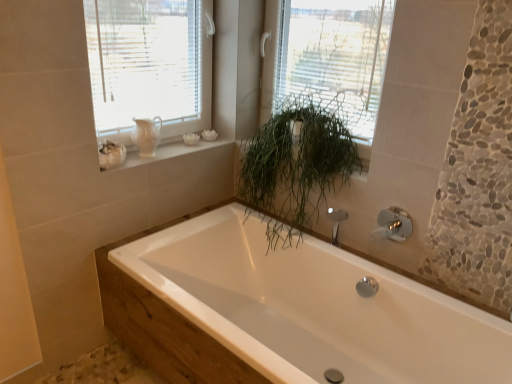
Identify the location of green leafy plant at upper center. Image resolution: width=512 pixels, height=384 pixels. (327, 60).

This screenshot has height=384, width=512. Describe the element at coordinates (393, 225) in the screenshot. I see `chrome metallic faucet at upper right` at that location.

Measure the distance between point (222,267) and camera.

A distance of 7.18 feet exists between point (222,267) and camera.

Describe the element at coordinates (162, 152) in the screenshot. I see `white ceramic vase at upper left` at that location.

Measure the distance between point (152, 133) and camera.

7.08 feet.

Measure the distance between matte white pitcher at upper left and camera.

The distance of matte white pitcher at upper left from camera is 6.77 feet.

I want to click on green leafy plant at upper center, so click(327, 60).

Between matte white pitcher at upper left and green leafy plant at center, which one has less height?

matte white pitcher at upper left.

Consider the image. Is matte white pitcher at upper left closer to the viewer compared to green leafy plant at center?

That is False.

Considering the positions of objects matte white pitcher at upper left and green leafy plant at center in the image provided, who is more to the left, matte white pitcher at upper left or green leafy plant at center?

matte white pitcher at upper left.

Is green leafy plant at center located within matte white pitcher at upper left?

Definitely not — green leafy plant at center is not inside matte white pitcher at upper left.

Which object is positioned more to the left, matte white pitcher at upper left or white glossy bathtub at center?

From the viewer's perspective, matte white pitcher at upper left appears more on the left side.

Is matte white pitcher at upper left wider than white glossy bathtub at center?

No.

From the image's perspective, which object appears higher, matte white pitcher at upper left or white glossy bathtub at center?

matte white pitcher at upper left, from the image's perspective.

Relative to white glossy bathtub at center, is matte white pitcher at upper left in front or behind?

Visually, matte white pitcher at upper left is located behind white glossy bathtub at center.

Can you see green leafy plant at upper center touching matte white pitcher at upper left?

No, green leafy plant at upper center is not in contact with matte white pitcher at upper left.

Is green leafy plant at upper center completely or partially outside of matte white pitcher at upper left?

green leafy plant at upper center lies outside matte white pitcher at upper left's area.

Considering the positions of objects green leafy plant at upper center and green leafy plant at center in the image provided, who is in front, green leafy plant at upper center or green leafy plant at center?

green leafy plant at center is more forward.

From the image's perspective, is green leafy plant at upper center beneath green leafy plant at center?

Incorrect, from the image's perspective, green leafy plant at upper center is higher than green leafy plant at center.

Is green leafy plant at upper center inside or outside of green leafy plant at center?

The correct answer is: outside.

Considering the positions of point (290, 66) and point (308, 171), is point (290, 66) closer or farther from the camera than point (308, 171)?

Point (290, 66) is positioned farther from the camera compared to point (308, 171).

Is green leafy plant at center oriented away from green leafy plant at upper center?

No, green leafy plant at center is not facing away from green leafy plant at upper center.

Between green leafy plant at center and green leafy plant at upper center, which one appears on the left side from the viewer's perspective?

green leafy plant at center.

Is green leafy plant at center spatially inside green leafy plant at upper center, or outside of it?

green leafy plant at center lies outside green leafy plant at upper center.

Is green leafy plant at center shorter than green leafy plant at upper center?

In fact, green leafy plant at center may be taller than green leafy plant at upper center.

In the scene shown: Which is closer, (305, 211) or (379, 379)?

Point (305, 211) appears to be farther away from the viewer than point (379, 379).

Is green leafy plant at center facing away from white glossy bathtub at center?

That's not correct — green leafy plant at center is not looking away from white glossy bathtub at center.

Would you say green leafy plant at center is a long distance from white glossy bathtub at center?

No, green leafy plant at center is in close proximity to white glossy bathtub at center.

From the picture: Does green leafy plant at center have a greater height compared to white glossy bathtub at center?

Indeed, green leafy plant at center has a greater height compared to white glossy bathtub at center.

Is green leafy plant at center located within white glossy bathtub at center?

No, white glossy bathtub at center does not contain green leafy plant at center.

Measure the distance from white glossy bathtub at center to green leafy plant at center.

The distance of white glossy bathtub at center from green leafy plant at center is 17.27 inches.

Identify the location of plant that appears above the white glossy bathtub at center (from a real-world perspective). (297, 163).

Which is less distant, (x=241, y=317) or (x=255, y=156)?

Positioned in front is point (x=241, y=317).

Where is `gray on the left of the green leafy plant at center`? gray on the left of the green leafy plant at center is located at coordinates (146, 135).

Locate an element on the screen. gray behind the white glossy bathtub at center is located at coordinates (146, 135).

When comparing their distances from green leafy plant at center, does white ceramic vase at upper left or white glossy bathtub at center seem closer?

Based on the image, white glossy bathtub at center appears to be nearer to green leafy plant at center.

When comparing their distances from green leafy plant at center, does green leafy plant at upper center or white glossy bathtub at center seem closer?

green leafy plant at upper center.

From the image, which object appears to be farther from white glossy bathtub at center, matte white pitcher at upper left or chrome metallic faucet at upper right?

matte white pitcher at upper left.

Which object lies nearer to the anchor point green leafy plant at upper center, white glossy bathtub at center or chrome metallic faucet at upper right?

The object closer to green leafy plant at upper center is chrome metallic faucet at upper right.

Which object lies nearer to the anchor point white glossy bathtub at center, green leafy plant at center or white ceramic vase at upper left?

green leafy plant at center is closer to white glossy bathtub at center.

From the image, which object appears to be farther from green leafy plant at upper center, white glossy bathtub at center or white ceramic vase at upper left?

white glossy bathtub at center lies further to green leafy plant at upper center than the other object.

When comparing their distances from chrome metallic faucet at upper right, does white glossy bathtub at center or matte white pitcher at upper left seem further?

Based on the image, matte white pitcher at upper left appears to be further to chrome metallic faucet at upper right.

Which object lies nearer to the anchor point white glossy bathtub at center, white ceramic vase at upper left or chrome metallic faucet at upper right?

chrome metallic faucet at upper right lies closer to white glossy bathtub at center than the other object.

The width and height of the screenshot is (512, 384). In order to click on plant between white ceramic vase at upper left and chrome metallic faucet at upper right in this screenshot , I will do `click(297, 163)`.

Locate an element on the screen. Image resolution: width=512 pixels, height=384 pixels. plant between green leafy plant at upper center and chrome metallic faucet at upper right vertically is located at coordinates (297, 163).

The image size is (512, 384). Identify the location of tap between green leafy plant at upper center and white glossy bathtub at center vertically. (393, 225).

Identify the location of window sill between green leafy plant at upper center and white glossy bathtub at center in the vertical direction. (162, 152).